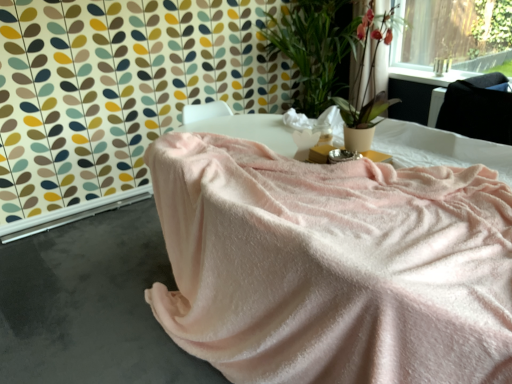
Find the location of a particular element. free point above pink soft fabric at lower left (from a real-world perspective) is located at coordinates (92, 284).